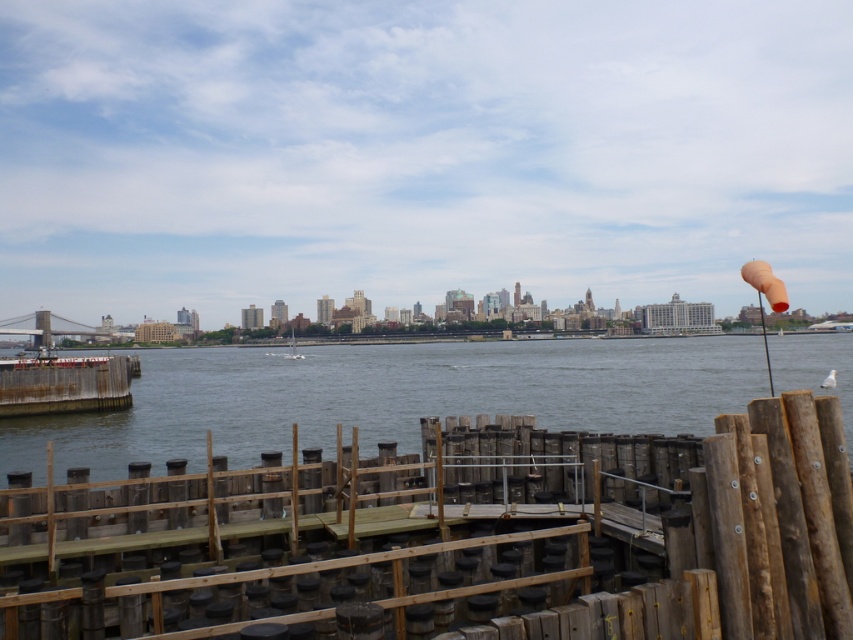
Who is positioned more to the left, brown wooden fence at lower center or gray water at lower left?

brown wooden fence at lower center is more to the left.

Which is behind, point (461, 465) or point (457, 397)?

Point (457, 397)

Is point (592, 436) farther from viewer compared to point (160, 449)?

No, it is not.

Find the location of a particular element. This screenshot has height=640, width=853. brown wooden fence at lower center is located at coordinates (456, 540).

Between point (367, 400) and point (289, 355), which one is positioned in front?

Point (367, 400) is in front.

Can you confirm if gray water at lower left is positioned to the left of white matte sailboat at center?

In fact, gray water at lower left is to the right of white matte sailboat at center.

Locate an element on the screen. The height and width of the screenshot is (640, 853). gray water at lower left is located at coordinates (389, 397).

From the picture: Which is more to the right, brown wooden fence at lower center or white matte sailboat at center?

Positioned to the right is brown wooden fence at lower center.

Who is taller, brown wooden fence at lower center or white matte sailboat at center?

white matte sailboat at center

Image resolution: width=853 pixels, height=640 pixels. I want to click on brown wooden fence at lower center, so (x=456, y=540).

Find the location of `brown wooden fence at lower center`. brown wooden fence at lower center is located at coordinates (456, 540).